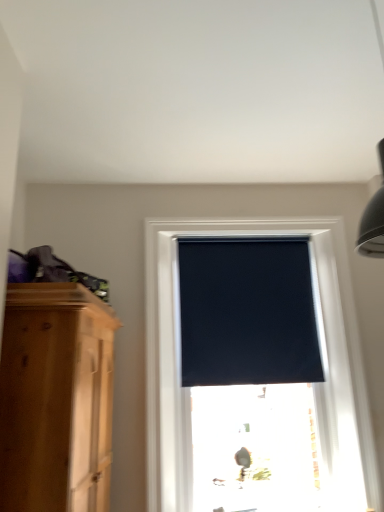
What is the approximate height of black matte window at center?

It is 2.04 meters.

At what (x,y) coordinates should I click in order to perform the action: click on black matte window at center. Please return your answer as a coordinate pair (x, y). This screenshot has height=512, width=384. Looking at the image, I should click on (324, 350).

In order to face black matte window at center, should I rotate leftwards or rightwards?

Rotate your view right by about 8.391°.

What do you see at coordinates (324, 350) in the screenshot? I see `black matte window at center` at bounding box center [324, 350].

The width and height of the screenshot is (384, 512). What are the coordinates of `black matte window blind at center` in the screenshot? It's located at (247, 312).

What do you see at coordinates (247, 312) in the screenshot?
I see `black matte window blind at center` at bounding box center [247, 312].

Where is `black matte window at center`? Image resolution: width=384 pixels, height=512 pixels. black matte window at center is located at coordinates (324, 350).

Is black matte window at center to the right of black matte window blind at center from the viewer's perspective?

Correct, you'll find black matte window at center to the right of black matte window blind at center.

Which object is closer to the camera, black matte window at center or black matte window blind at center?

black matte window at center is in front.

Does point (147, 321) come behind point (181, 309)?

No, (147, 321) is closer to viewer.

From the image's perspective, who appears lower, black matte window at center or black matte window blind at center?

black matte window at center is shown below in the image.

From a real-world perspective, between black matte window at center and black matte window blind at center, who is vertically higher?

In real-world perspective, black matte window blind at center is above.

Can you confirm if black matte window at center is wider than black matte window blind at center?

Yes.

Between black matte window at center and black matte window blind at center, which one has more height?

With more height is black matte window at center.

Looking at the image, does black matte window at center seem bigger or smaller compared to black matte window blind at center?

Considering their sizes, black matte window at center takes up more space than black matte window blind at center.

Based on the photo, is black matte window at center spatially inside black matte window blind at center, or outside of it?

The correct answer is: outside.

Are black matte window at center and black matte window blind at center located far from each other?

No, black matte window at center is in close proximity to black matte window blind at center.

Could you tell me if black matte window at center is turned towards black matte window blind at center?

Yes, black matte window at center is aimed at black matte window blind at center.

How many degrees apart are the facing directions of black matte window at center and black matte window blind at center?

0.013 degrees separate the facing orientations of black matte window at center and black matte window blind at center.

This screenshot has width=384, height=512. I want to click on window blind to the left of black matte window at center, so click(247, 312).

Is black matte window blind at center at the left side of black matte window at center?

Indeed, black matte window blind at center is positioned on the left side of black matte window at center.

Considering the positions of objects black matte window blind at center and black matte window at center in the image provided, who is behind, black matte window blind at center or black matte window at center?

black matte window blind at center is more distant.

Considering the positions of point (265, 290) and point (300, 234), is point (265, 290) closer or farther from the camera than point (300, 234)?

Point (265, 290) appears to be closer to the viewer than point (300, 234).

From the image's perspective, is black matte window blind at center under black matte window at center?

Actually, black matte window blind at center appears above black matte window at center in the image.

From a real-world perspective, is black matte window blind at center on top of black matte window at center?

Yes, from a real-world perspective, black matte window blind at center is over black matte window at center

Based on the photo, does black matte window blind at center have a lesser width compared to black matte window at center?

Indeed, black matte window blind at center has a lesser width compared to black matte window at center.

Is black matte window blind at center shorter than black matte window at center?

Indeed, black matte window blind at center has a lesser height compared to black matte window at center.

Does black matte window blind at center have a smaller size compared to black matte window at center?

Yes, black matte window blind at center is smaller than black matte window at center.

Is black matte window blind at center outside of black matte window at center?

Actually, black matte window blind at center is at least partially inside black matte window at center.

Looking at this image, are black matte window blind at center and black matte window at center located far from each other?

No.

Is black matte window blind at center aimed at black matte window at center?

Yes.

How many degrees apart are the facing directions of black matte window blind at center and black matte window at center?

0.013 degrees separate the facing orientations of black matte window blind at center and black matte window at center.

Where is `window blind above the black matte window at center (from a real-world perspective)`? window blind above the black matte window at center (from a real-world perspective) is located at coordinates (247, 312).

There is a black matte window at center. Where is `window blind above it (from a real-world perspective)`? This screenshot has height=512, width=384. window blind above it (from a real-world perspective) is located at coordinates (247, 312).

This screenshot has height=512, width=384. I want to click on window below the black matte window blind at center (from the image's perspective), so click(324, 350).